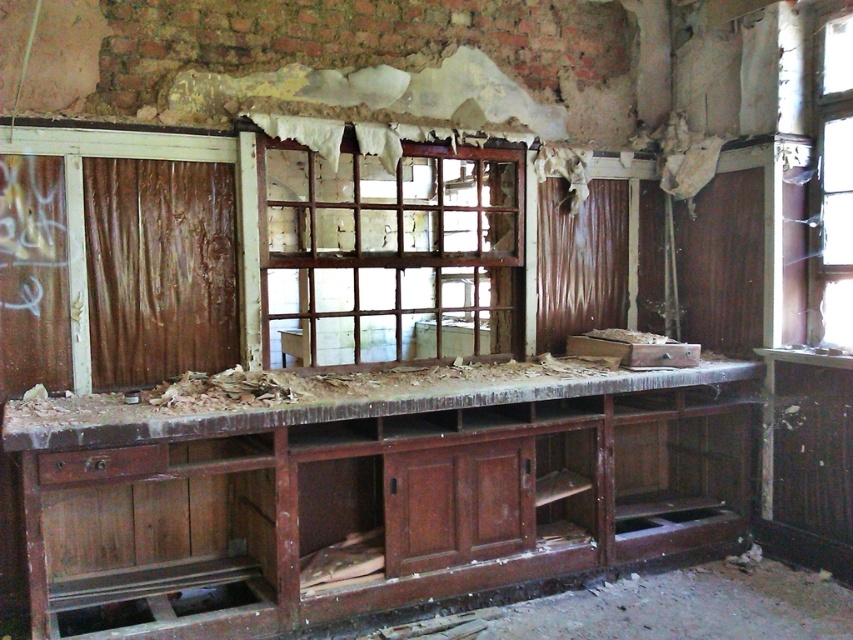
Can you confirm if rusty wood workbench at center is positioned above transparent glass window at upper right?

Actually, rusty wood workbench at center is below transparent glass window at upper right.

Does rusty wood workbench at center appear on the right side of transparent glass window at upper right?

Incorrect, rusty wood workbench at center is not on the right side of transparent glass window at upper right.

Which is behind, point (556, 572) or point (822, 323)?

Point (822, 323)

Where is `rusty wood workbench at center`? The height and width of the screenshot is (640, 853). rusty wood workbench at center is located at coordinates (367, 488).

Is rusty wood workbench at center further to camera compared to wooden debris at center?

Yes, it is behind wooden debris at center.

Image resolution: width=853 pixels, height=640 pixels. I want to click on rusty wood workbench at center, so click(x=367, y=488).

Locate an element on the screen. The image size is (853, 640). rusty wood workbench at center is located at coordinates (367, 488).

Who is lower down, rusty wood workbench at center or brown wooden window at center?

rusty wood workbench at center is lower down.

Between rusty wood workbench at center and brown wooden window at center, which one has more height?

With more height is brown wooden window at center.

Is point (149, 490) in front of point (419, 288)?

Yes, it is in front of point (419, 288).

Identify the location of rusty wood workbench at center. (367, 488).